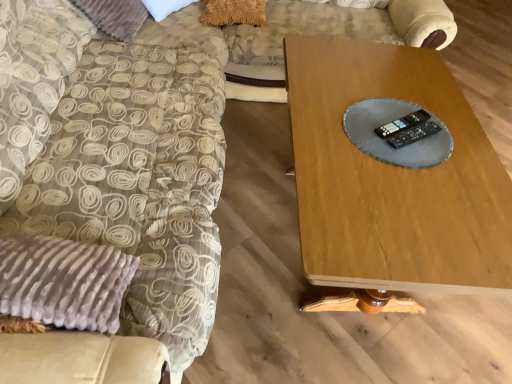
Find the location of a particular element. The image size is (512, 384). free space behind black plastic remote at center, which appears as the second control when ordered from the bottom is located at coordinates (393, 99).